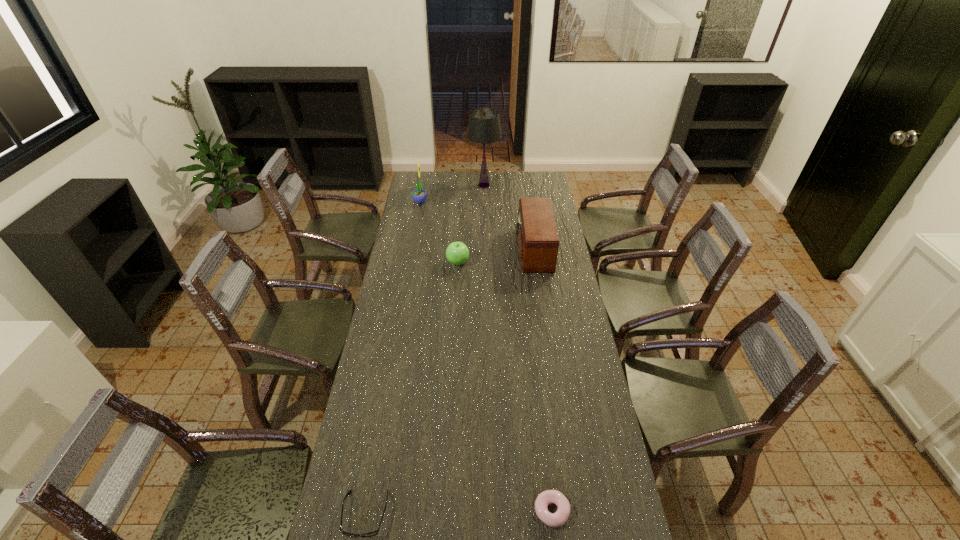
Image resolution: width=960 pixels, height=540 pixels. Identify the location of the tallest object. (484, 127).

This screenshot has height=540, width=960. I want to click on lampshade, so click(484, 127).

Locate an element on the screen. The width and height of the screenshot is (960, 540). the second tallest object is located at coordinates (419, 195).

This screenshot has width=960, height=540. What are the coordinates of `the second farthest object` in the screenshot? It's located at (419, 195).

Identify the location of radio receiver. The width and height of the screenshot is (960, 540). (538, 241).

Where is `the fourth tallest object`? the fourth tallest object is located at coordinates (457, 253).

Identify the location of doughnut. (559, 518).

Find the location of `free space located 0.110m on the front-facing side of the farthest object`. free space located 0.110m on the front-facing side of the farthest object is located at coordinates (484, 205).

At what (x,y) coordinates should I click in order to perform the action: click on vacant area situated on the front-facing side of the second tallest object. Please return your answer as a coordinate pair (x, y). The width and height of the screenshot is (960, 540). Looking at the image, I should click on (471, 201).

Locate an element on the screen. Image resolution: width=960 pixels, height=540 pixels. vacant space located 0.260m on the front-facing side of the fourth shortest object is located at coordinates (462, 249).